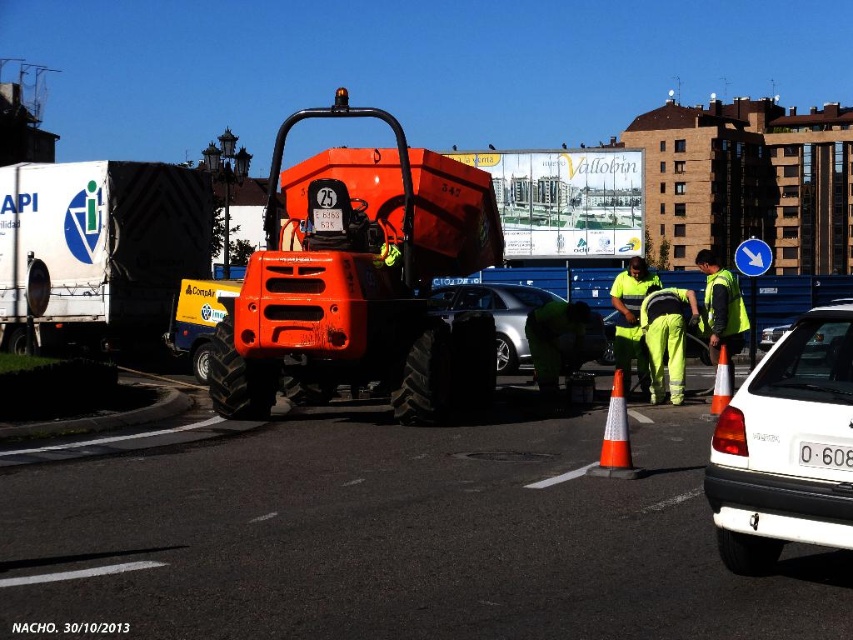
Question: Which point appears closest to the camera in this image?

Choices:
 (A) (616, 339)
 (B) (715, 291)
 (C) (715, 502)

Answer: (C)

Question: In this image, where is metallic silver car at center located relative to whiteplasticlicense plate at lower right?

Choices:
 (A) below
 (B) above

Answer: (B)

Question: Estimate the real-world distances between objects in this image. Which object is farther from the metallic silver car at center?

Choices:
 (A) whiteplasticlicense plate at lower right
 (B) orange matte construction vehicle at center

Answer: (B)

Question: Based on their relative distances, which object is nearer to the white matte truck at left?

Choices:
 (A) white matte car at right
 (B) high visibility yellow jacket at center
 (C) whiteplasticlicense plate at lower right
 (D) orange matte construction vehicle at center

Answer: (B)

Question: Can you confirm if white matte truck at left is smaller than high visibility yellow-green fabric safety vest at center-right?

Choices:
 (A) yes
 (B) no

Answer: (B)

Question: Is white matte truck at left above high visibility yellow jacket at center?

Choices:
 (A) yes
 (B) no

Answer: (A)